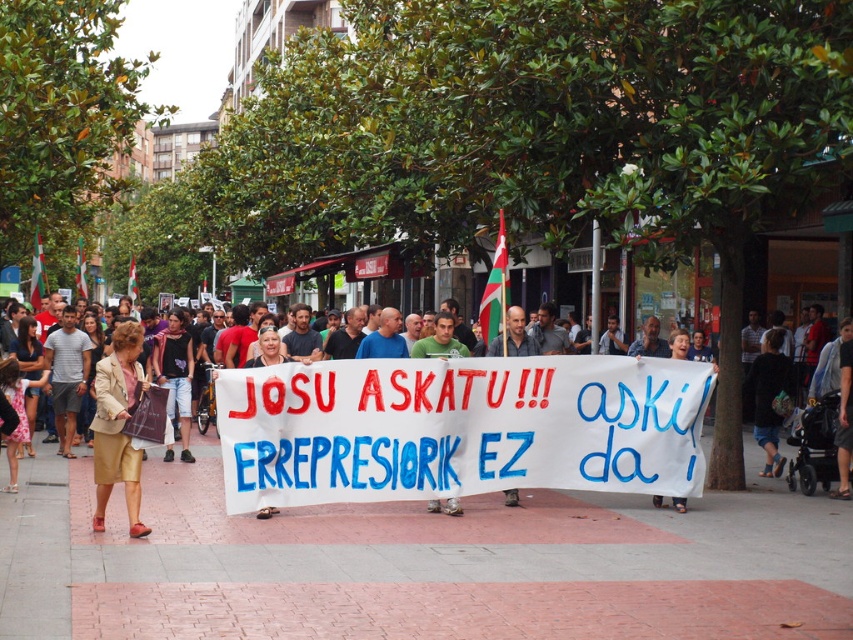
Question: Observing the image, what is the correct spatial positioning of gray concrete pavement at center in reference to white fabric banner at center?

Choices:
 (A) right
 (B) left

Answer: (B)

Question: Which of the following is the farthest from the observer?

Choices:
 (A) gray concrete pavement at center
 (B) white fabric banner at center
 (C) gold fabric skirt at lower left

Answer: (B)

Question: Is white fabric banner at center smaller than gold fabric skirt at lower left?

Choices:
 (A) no
 (B) yes

Answer: (A)

Question: Which object is the closest to the gray concrete pavement at center?

Choices:
 (A) gold fabric skirt at lower left
 (B) white fabric banner at center

Answer: (B)

Question: Which object is farther from the camera taking this photo?

Choices:
 (A) white fabric banner at center
 (B) gold fabric skirt at lower left

Answer: (A)

Question: Is gray concrete pavement at center positioned in front of white fabric banner at center?

Choices:
 (A) no
 (B) yes

Answer: (B)